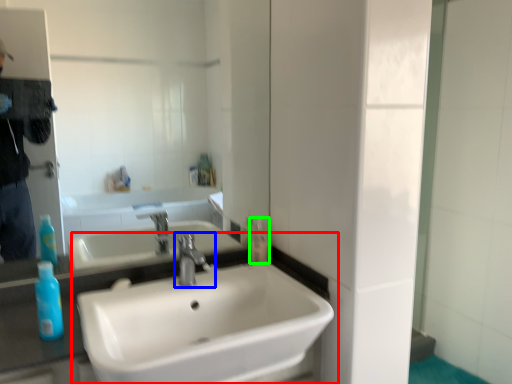
Question: Based on their relative distances, which object is nearer to sink (highlighted by a red box)? Choose from tap (highlighted by a blue box) and mouthwash (highlighted by a green box).

Choices:
 (A) tap
 (B) mouthwash

Answer: (A)